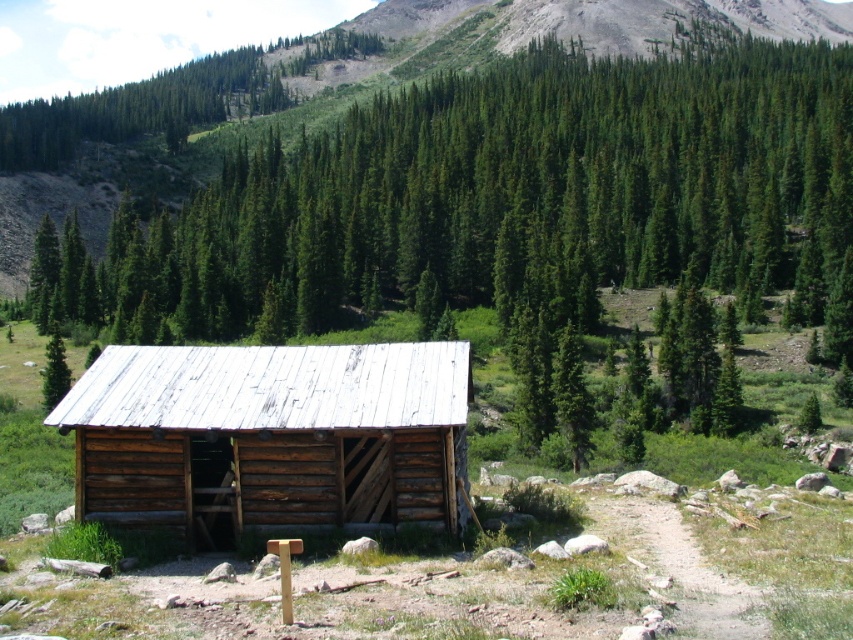
You are standing at the entrance of the rustic wooden cabin and notice two points marked in the scene. The first point is located at coordinates point (781,205), and the second point is at point (45,352). Which of these points is closer to your current position?

Point (45,352) is closer to your current position because it is nearer to the camera compared to point (781,205), which is further away.

You are standing in front of the weathered wood cabin at center and want to walk towards the green matte tree at center. Which direction should you move to reach the tree?

The weathered wood cabin at center is to the right of the green matte tree at center, so you should move to your left to reach the green matte tree at center.

You are a hiker who wants to take a photo of the weathered wood shed at center and the green matte tree at center. Which object should you focus on first if you want to capture both in a single frame without moving the camera?

The weathered wood shed at center is smaller than the green matte tree at center, so you should focus on the green matte tree at center first to ensure it fits within the frame.